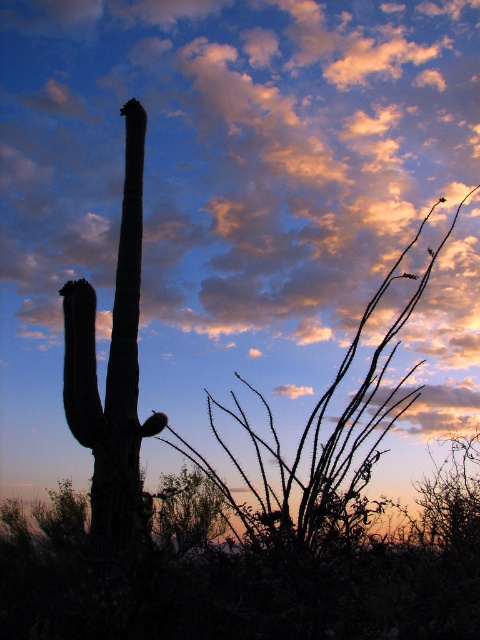
Based on the scene description, what is the 2D coordinate of the orange cotton cloud at upper center?

The orange cotton cloud at upper center is located at the 2D coordinate point of (x=230, y=154).

Based on the coordinates provided, can you identify which object in the scene corresponds to the point labeled as point (230, 154)?

The orange cotton cloud at upper center corresponds to the point labeled as point (230, 154).

Based on the scene description, which object has a smaller width between the orange cotton cloud at upper center and the silhouette cactus at left?

The orange cotton cloud at upper center has a smaller width compared to the silhouette cactus at left.